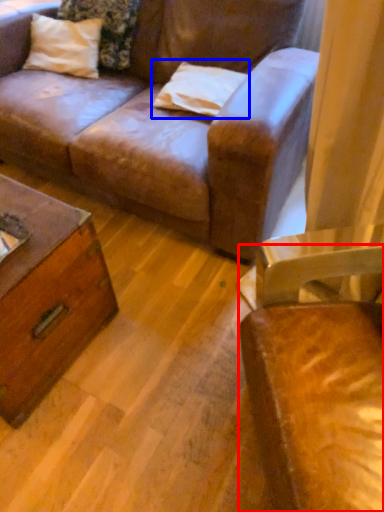
Question: Which point is closer to the camera, chair (highlighted by a red box) or pillow (highlighted by a blue box)?

Choices:
 (A) chair
 (B) pillow

Answer: (A)